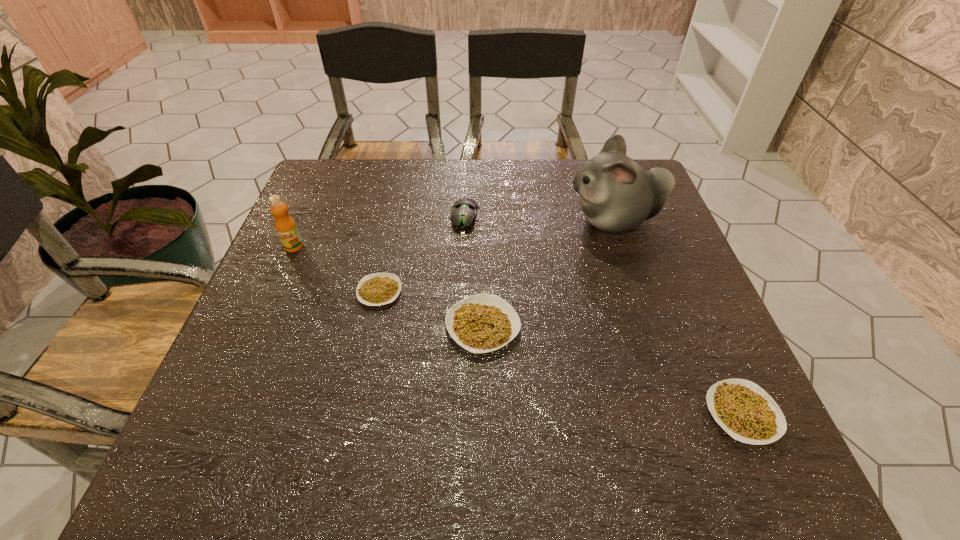
Where is `free space between the leftmost legume and the computer mouse`? The image size is (960, 540). free space between the leftmost legume and the computer mouse is located at coordinates (422, 254).

Where is `free space that is in between the hamster and the computer mouse`? free space that is in between the hamster and the computer mouse is located at coordinates (539, 219).

Locate an element on the screen. free space between the shortest object and the second legume from left to right is located at coordinates (431, 309).

I want to click on free space that is in between the computer mouse and the second legume from left to right, so click(473, 272).

Locate an element on the screen. This screenshot has height=540, width=960. vacant space that's between the computer mouse and the leftmost legume is located at coordinates (422, 254).

Identify which object is located as the third nearest to the leftmost legume. Please provide its 2D coordinates. Your answer should be formatted as a tuple, i.e. [(x, y)], where the tuple contains the x and y coordinates of a point satisfying the conditions above.

[(464, 211)]

The image size is (960, 540). What are the coordinates of `object that ranks as the third closest to the computer mouse` in the screenshot? It's located at click(x=617, y=194).

The image size is (960, 540). Find the location of `legume that is the second closest to the leftmost legume`. legume that is the second closest to the leftmost legume is located at coordinates (743, 409).

Identify which legume is located as the second nearest to the second object from left to right. Please provide its 2D coordinates. Your answer should be formatted as a tuple, i.e. [(x, y)], where the tuple contains the x and y coordinates of a point satisfying the conditions above.

[(743, 409)]

The image size is (960, 540). Identify the location of free space that satisfies the following two spatial constraints: 1. on the back side of the computer mouse; 2. on the left side of the shortest legume. (396, 217).